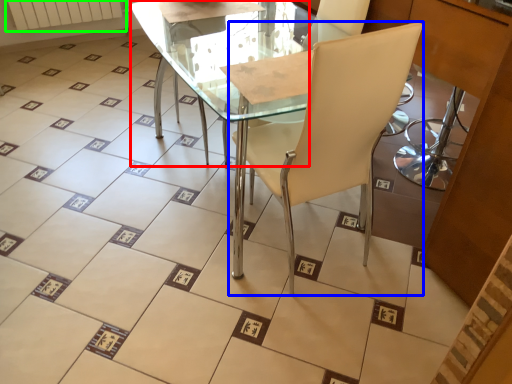
Question: Estimate the real-world distances between objects in this image. Which object is closer to round table (highlighted by a red box), chair (highlighted by a blue box) or radiator (highlighted by a green box)?

Choices:
 (A) chair
 (B) radiator

Answer: (A)